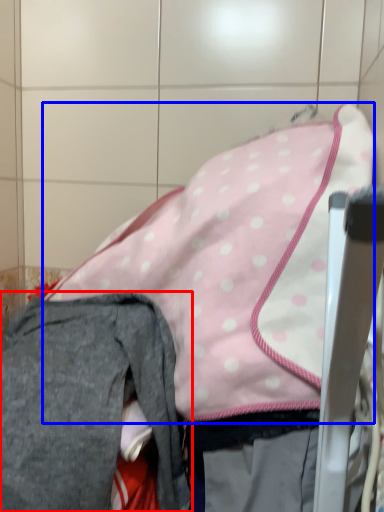
Question: Among these objects, which one is nearest to the camera, trousers (highlighted by a red box) or wide (highlighted by a blue box)?

Choices:
 (A) trousers
 (B) wide

Answer: (A)